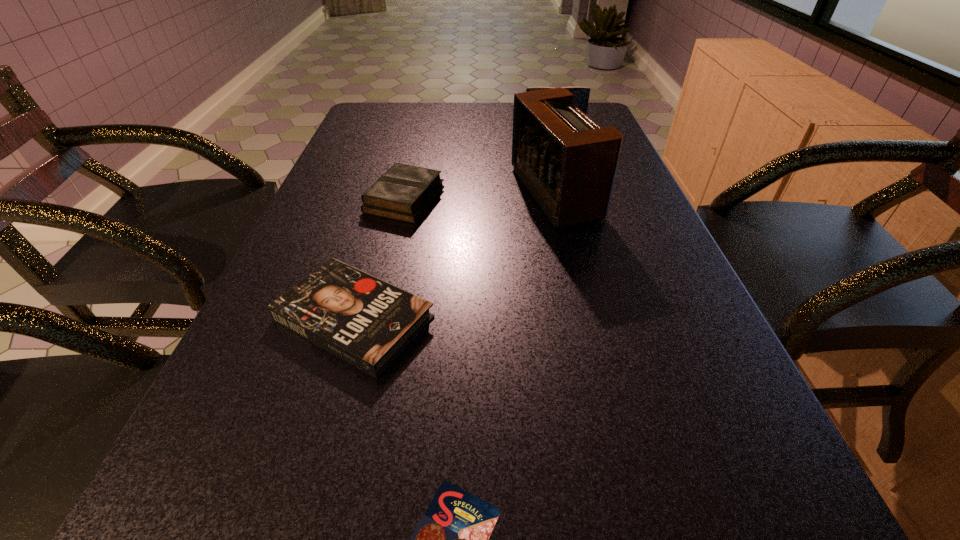
Find the location of `free spot between the radio receiver and the second farthest book`. free spot between the radio receiver and the second farthest book is located at coordinates (480, 197).

At what (x,y) coordinates should I click in order to perform the action: click on free spot between the radio receiver and the nearest book. Please return your answer as a coordinate pair (x, y). Looking at the image, I should click on (454, 256).

The width and height of the screenshot is (960, 540). I want to click on unoccupied position between the second shortest book and the tallest book, so click(x=479, y=164).

At what (x,y) coordinates should I click in order to perform the action: click on vacant area that lies between the third shortest object and the radio receiver. Please return your answer as a coordinate pair (x, y). The height and width of the screenshot is (540, 960). Looking at the image, I should click on coord(480,197).

At what (x,y) coordinates should I click in order to perform the action: click on object that is the closest to the tallest book. Please return your answer as a coordinate pair (x, y). Looking at the image, I should click on (568, 163).

Locate an element on the screen. the fourth closest object to the nearest object is located at coordinates (581, 94).

This screenshot has height=540, width=960. Find the location of `book identified as the second closest to the shortest object`. book identified as the second closest to the shortest object is located at coordinates (404, 192).

Where is `the closest book to the second tallest object`? This screenshot has height=540, width=960. the closest book to the second tallest object is located at coordinates (404, 192).

Find the location of a particular element. vacant space that satisfies the following two spatial constraints: 1. on the back side of the radio receiver; 2. on the right side of the second shortest book is located at coordinates (406, 193).